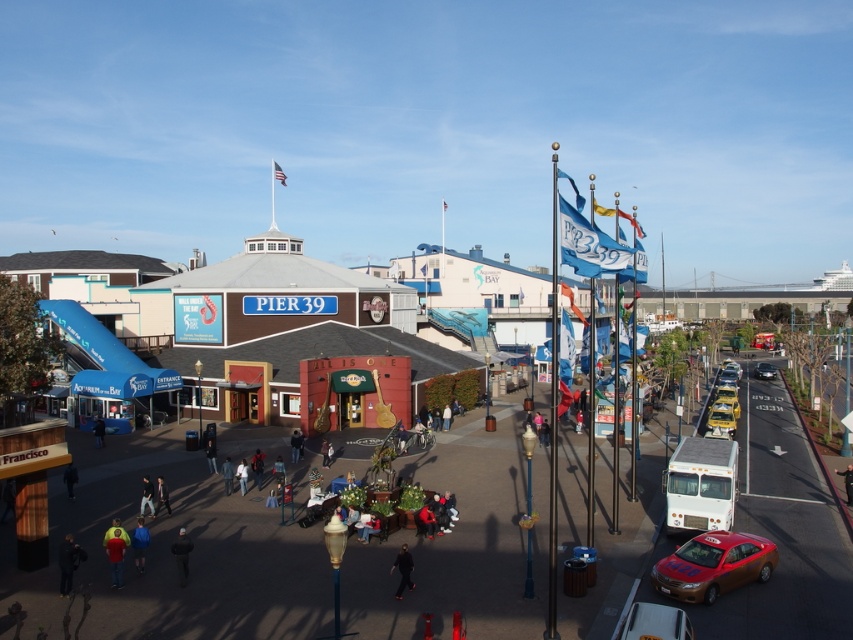
Question: Which is farther from the shiny red car at lower right?

Choices:
 (A) dark gray jacket at center
 (B) dark blue jacket at center
 (C) dark gray pants at center

Answer: (B)

Question: Can you confirm if dark blue jacket at lower left is positioned to the right of dark gray jacket at center?

Choices:
 (A) yes
 (B) no

Answer: (B)

Question: Which is nearer to the dark gray jacket at center?

Choices:
 (A) light blue jeans at center
 (B) shiny red car at lower right
 (C) dark blue jacket at lower left
 (D) dark blue jacket at center

Answer: (A)

Question: Among these points, which one is farthest from the camera?

Choices:
 (A) pyautogui.click(x=398, y=584)
 (B) pyautogui.click(x=120, y=564)
 (C) pyautogui.click(x=746, y=572)

Answer: (B)

Question: Is metallic silver car at lower right above black fabric jacket at lower left?

Choices:
 (A) yes
 (B) no

Answer: (B)

Question: Where is metallic silver car at lower right located in relation to dark gray jacket at center in the image?

Choices:
 (A) above
 (B) below

Answer: (B)